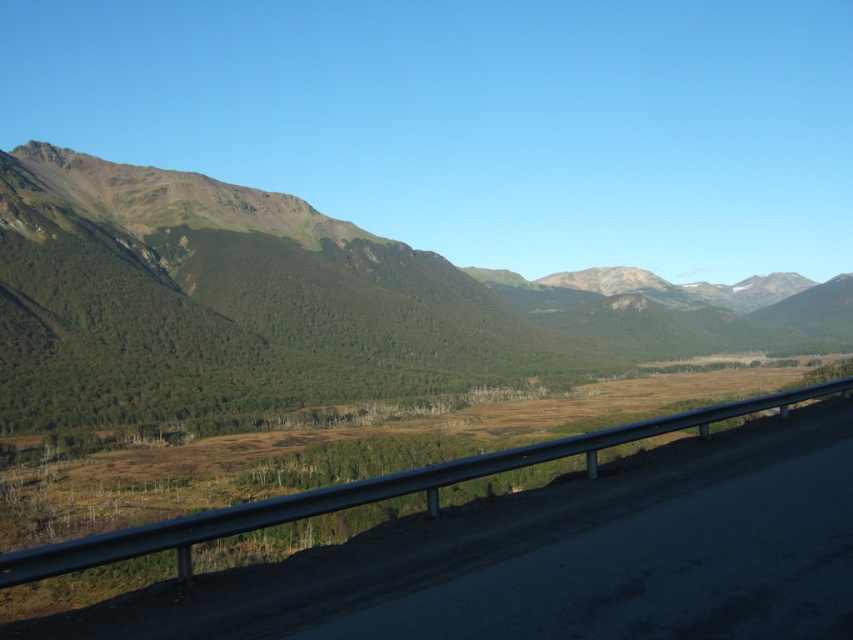
Question: Does green grassy mountain at left lie in front of metallic gray highway at center?

Choices:
 (A) no
 (B) yes

Answer: (A)

Question: Among these points, which one is farthest from the camera?

Choices:
 (A) (346, 372)
 (B) (42, 627)

Answer: (A)

Question: Is green grassy mountain at left below metallic gray highway at center?

Choices:
 (A) yes
 (B) no

Answer: (B)

Question: Is green grassy mountain at left in front of metallic gray highway at center?

Choices:
 (A) yes
 (B) no

Answer: (B)

Question: Which of the following is the farthest from the observer?

Choices:
 (A) metallic gray highway at center
 (B) green grassy mountain at left

Answer: (B)